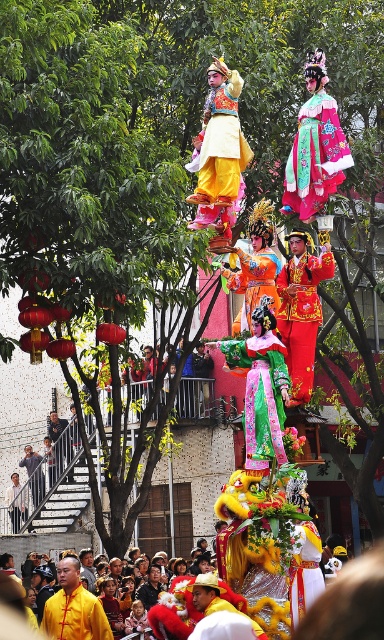
You are a photographer standing at the center of the festival. You want to capture the gold brocade robe at center in your photo. Where should you aim your camera?

You should aim your camera at point (x=301, y=316) to capture the gold brocade robe at center.

You are a photographer trying to capture the entire scene of the festival. You notice the green leafy tree at upper center and the shiny orange fabric at center. Which object would you need to adjust your camera angle to include in your photo first?

The green leafy tree at upper center is much taller than the shiny orange fabric at center, so you would need to adjust your camera angle to include the green leafy tree at upper center first.